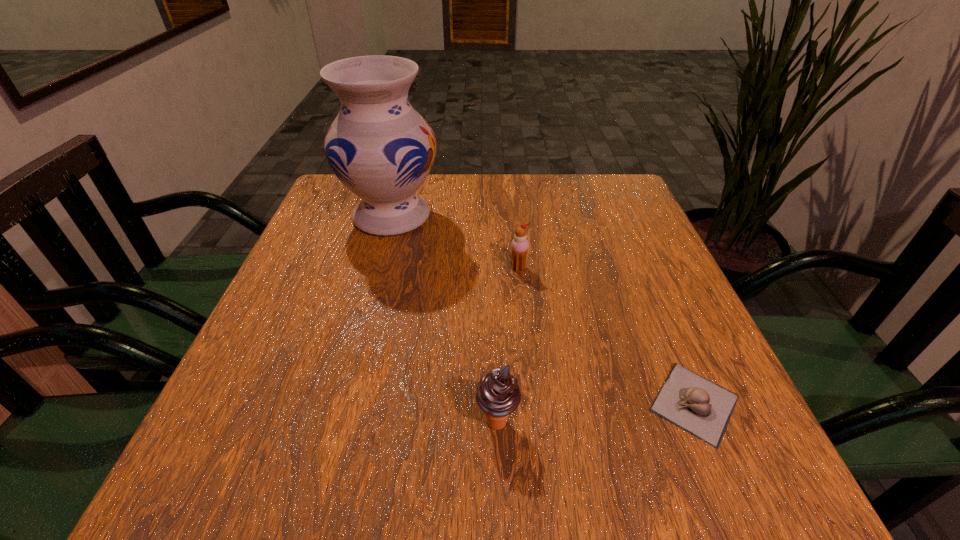
This screenshot has width=960, height=540. In order to click on vacant point located between the garlic and the second shortest object in this screenshot , I will do `click(607, 335)`.

The height and width of the screenshot is (540, 960). Identify the location of free space between the second object from left to right and the vase. (444, 319).

At what (x,y) coordinates should I click in order to perform the action: click on vacant area that lies between the second farthest object and the nearer icecream. Please return your answer as a coordinate pair (x, y). Looking at the image, I should click on (508, 345).

Identify the location of vacant area that lies between the rightmost object and the second object from left to right. (596, 413).

At what (x,y) coordinates should I click in order to perform the action: click on object that is the closest to the garlic. Please return your answer as a coordinate pair (x, y). Looking at the image, I should click on (498, 395).

Select which object appears as the second closest to the third object from left to right. Please provide its 2D coordinates. Your answer should be formatted as a tuple, i.e. [(x, y)], where the tuple contains the x and y coordinates of a point satisfying the conditions above.

[(695, 404)]

In order to click on free spot that satisfies the following two spatial constraints: 1. at the front with a straw on the rightmost object; 2. on the left side of the right icecream in this screenshot , I will do (x=532, y=403).

Identify the location of free space that satisfies the following two spatial constraints: 1. at the front with a straw on the shorter icecream; 2. on the left side of the garlic. (532, 403).

Find the location of `free spot that satisfies the following two spatial constraints: 1. on the front side of the shortest object; 2. on the left side of the leftmost object`. free spot that satisfies the following two spatial constraints: 1. on the front side of the shortest object; 2. on the left side of the leftmost object is located at coordinates tap(341, 403).

The height and width of the screenshot is (540, 960). I want to click on vacant space that satisfies the following two spatial constraints: 1. on the front side of the rightmost object; 2. on the left side of the vase, so click(341, 403).